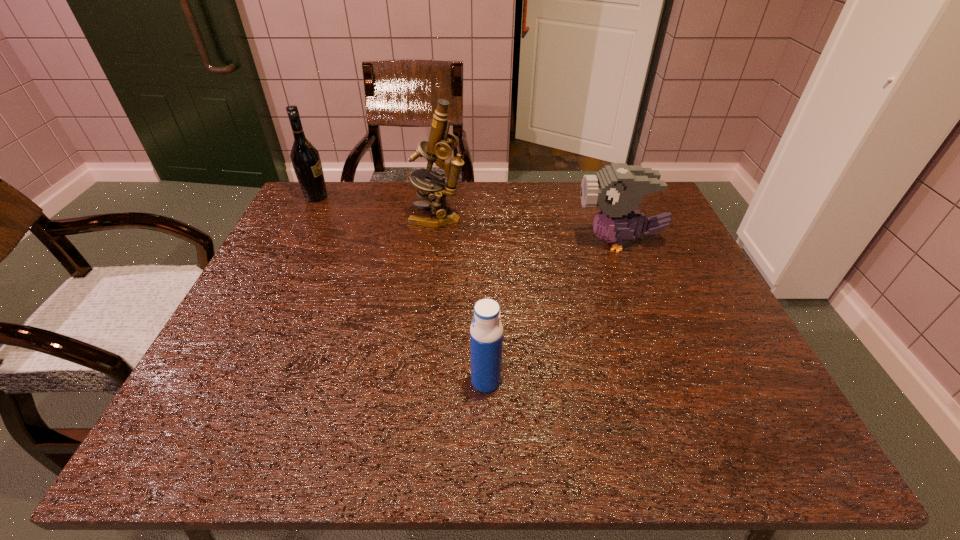
You are a GUI agent. You are given a task and a screenshot of the screen. Output one action in this format:
    pyautogui.click(x=<x>, y=<y>)
    Task: Click on the second farthest object
    This screenshot has width=960, height=540.
    Given the screenshot: What is the action you would take?
    pyautogui.click(x=441, y=143)

This screenshot has height=540, width=960. In order to click on the tallest object in this screenshot , I will do `click(441, 143)`.

Where is `the second tallest object`? The image size is (960, 540). the second tallest object is located at coordinates (305, 158).

Image resolution: width=960 pixels, height=540 pixels. In order to click on the farthest object in this screenshot , I will do `click(305, 158)`.

The image size is (960, 540). In order to click on bird in this screenshot , I will do `click(617, 189)`.

This screenshot has height=540, width=960. In order to click on the second nearest object in this screenshot , I will do `click(617, 189)`.

You are a GUI agent. You are given a task and a screenshot of the screen. Output one action in this format:
    pyautogui.click(x=<x>, y=<y>)
    Task: Click on the nearest object
    
    Given the screenshot: What is the action you would take?
    pyautogui.click(x=486, y=332)

Where is `water bottle`? water bottle is located at coordinates (486, 332).

The image size is (960, 540). In order to click on vacant space situated on the back of the third object from right to left in this screenshot , I will do `click(441, 194)`.

Image resolution: width=960 pixels, height=540 pixels. I want to click on free spot located 0.270m on the label of the leftmost object, so click(x=416, y=197).